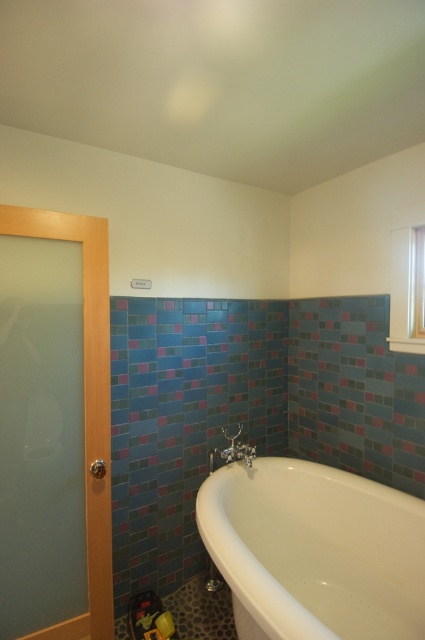
Question: Is frosted glass screen door at left above chrome metallic faucet at lower center?

Choices:
 (A) yes
 (B) no

Answer: (A)

Question: Is white glossy bathtub at lower right to the left of frosted glass screen door at left from the viewer's perspective?

Choices:
 (A) yes
 (B) no

Answer: (B)

Question: Among these points, which one is farthest from the camera?

Choices:
 (A) (365, 538)
 (B) (76, 230)

Answer: (A)

Question: Can you confirm if white glossy bathtub at lower right is bigger than chrome metallic faucet at lower center?

Choices:
 (A) no
 (B) yes

Answer: (B)

Question: Which point is closer to the camera taking this photo?

Choices:
 (A) (362, 492)
 (B) (243, 458)
 (C) (101, 371)

Answer: (C)

Question: Estimate the real-world distances between objects in this image. Which object is closer to the frosted glass screen door at left?

Choices:
 (A) white glossy bathtub at lower right
 (B) chrome metallic faucet at lower center

Answer: (B)